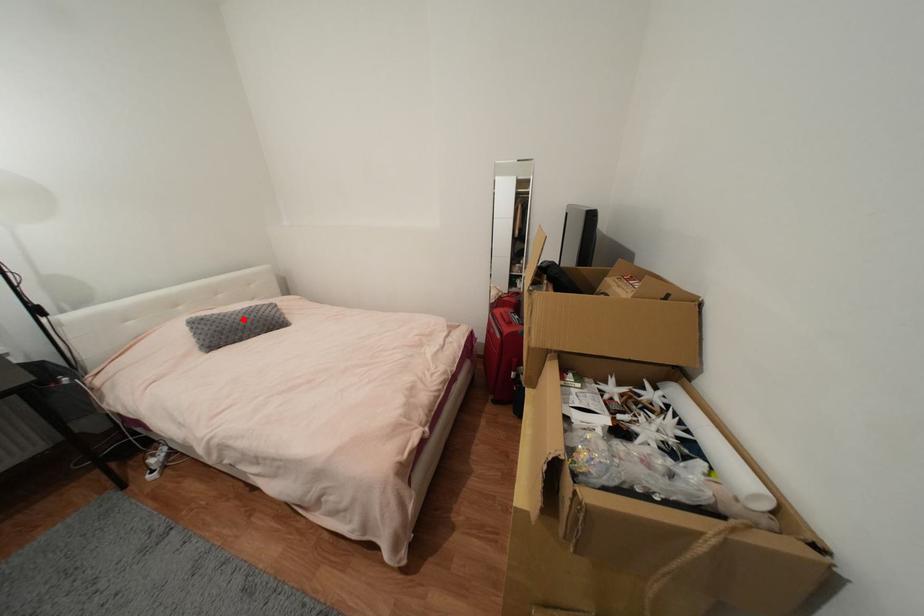
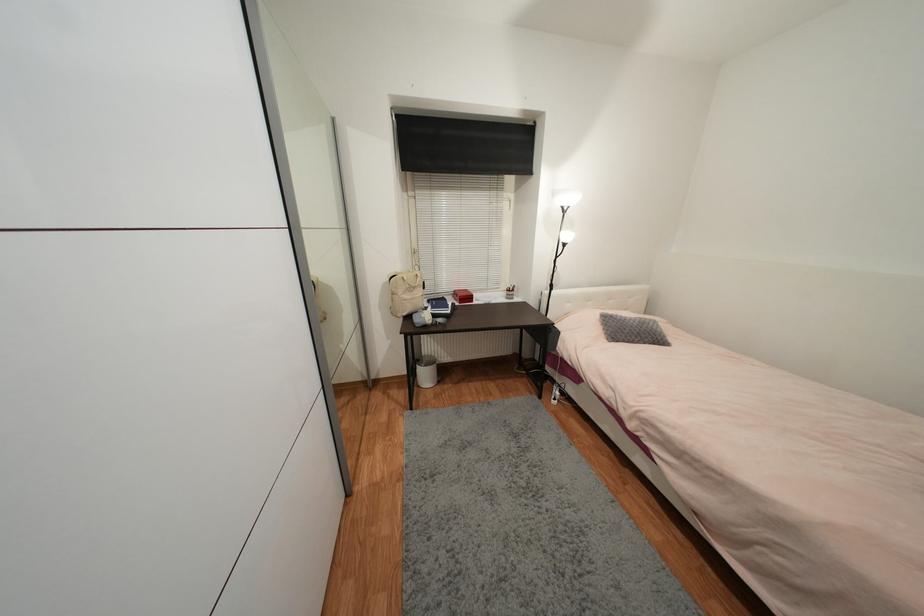
Question: A red point is marked in image1. In image2, is the corresponding 3D point closer to the camera or farther? Reply with the corresponding letter.

Choices:
 (A) The corresponding 3D point is closer.
 (B) The corresponding 3D point is farther.

Answer: (B)